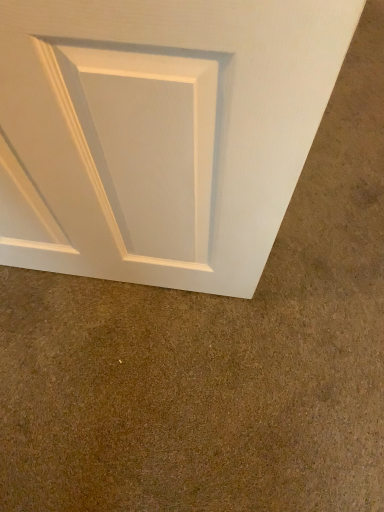
Image resolution: width=384 pixels, height=512 pixels. What do you see at coordinates (161, 132) in the screenshot?
I see `white matte door at center` at bounding box center [161, 132].

Where is `white matte door at center`? This screenshot has width=384, height=512. white matte door at center is located at coordinates (161, 132).

Image resolution: width=384 pixels, height=512 pixels. Identify the location of white matte door at center. (161, 132).